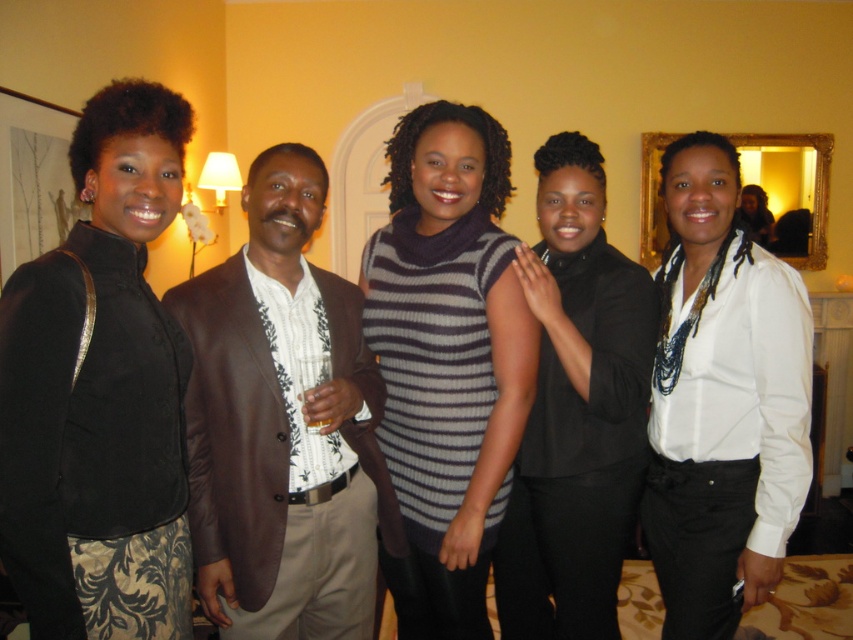
Which of these two, striped knit dress at center or black matte shirt at center, stands taller?

black matte shirt at center

Is striped knit dress at center taller than black matte shirt at center?

No, striped knit dress at center is not taller than black matte shirt at center.

The image size is (853, 640). What do you see at coordinates (447, 358) in the screenshot?
I see `striped knit dress at center` at bounding box center [447, 358].

Where is `striped knit dress at center`? Image resolution: width=853 pixels, height=640 pixels. striped knit dress at center is located at coordinates (447, 358).

Is brown leather jacket at center to the right of black matte shirt at center from the viewer's perspective?

No, brown leather jacket at center is not to the right of black matte shirt at center.

Does brown leather jacket at center appear under black matte shirt at center?

No.

I want to click on brown leather jacket at center, so click(x=282, y=426).

Where is `brown leather jacket at center`? brown leather jacket at center is located at coordinates click(x=282, y=426).

Does brown leather jacket at center have a greater width compared to white silk blouse at center?

Indeed, brown leather jacket at center has a greater width compared to white silk blouse at center.

Find the location of a particular element. The image size is (853, 640). brown leather jacket at center is located at coordinates (282, 426).